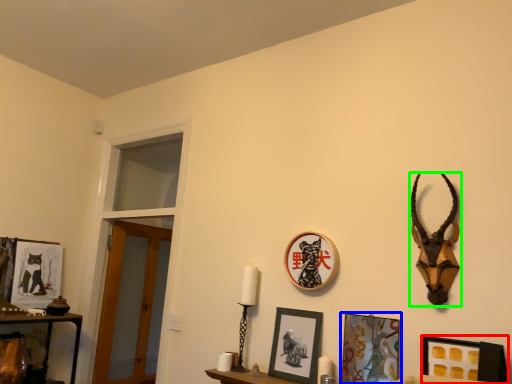
Question: Considering the real-world distances, which object is farthest from picture frame (highlighted by a red box)? picture frame (highlighted by a blue box) or antelope (highlighted by a green box)?

Choices:
 (A) picture frame
 (B) antelope

Answer: (B)